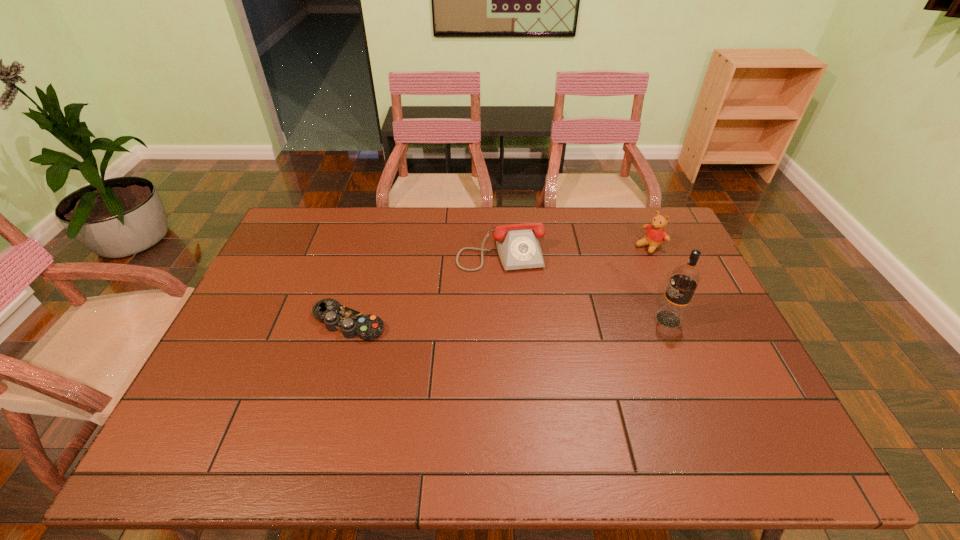
Where is `vacant region located 0.380m on the front-facing side of the teddy bear`? vacant region located 0.380m on the front-facing side of the teddy bear is located at coordinates (564, 305).

This screenshot has height=540, width=960. I want to click on vacant area situated 0.320m on the front-facing side of the teddy bear, so click(577, 295).

Where is `free point located on the front-facing side of the teddy bear`? free point located on the front-facing side of the teddy bear is located at coordinates (620, 266).

The image size is (960, 540). Find the location of `free space located 0.290m on the dial of the second object from left to right`. free space located 0.290m on the dial of the second object from left to right is located at coordinates (525, 345).

What are the coordinates of `vacant space located on the dial of the second object from left to right` in the screenshot? It's located at (526, 348).

You are a GUI agent. You are given a task and a screenshot of the screen. Output one action in this format:
    pyautogui.click(x=<x>, y=<y>)
    Task: Click on the vacant space located on the dial of the second object from left to right
    This screenshot has height=540, width=960.
    Given the screenshot: What is the action you would take?
    pyautogui.click(x=517, y=312)

You are a GUI agent. You are given a task and a screenshot of the screen. Output one action in this format:
    pyautogui.click(x=<x>, y=<y>)
    Task: Click on the teddy bear that is at the far edge
    
    Given the screenshot: What is the action you would take?
    pyautogui.click(x=655, y=235)

This screenshot has height=540, width=960. Identify the location of telephone that is at the far edge. (518, 247).

The height and width of the screenshot is (540, 960). Find the location of `vodka that is positioned at the right edge`. vodka that is positioned at the right edge is located at coordinates (685, 278).

Where is `teddy bear that is positioned at the right edge`? The image size is (960, 540). teddy bear that is positioned at the right edge is located at coordinates (655, 235).